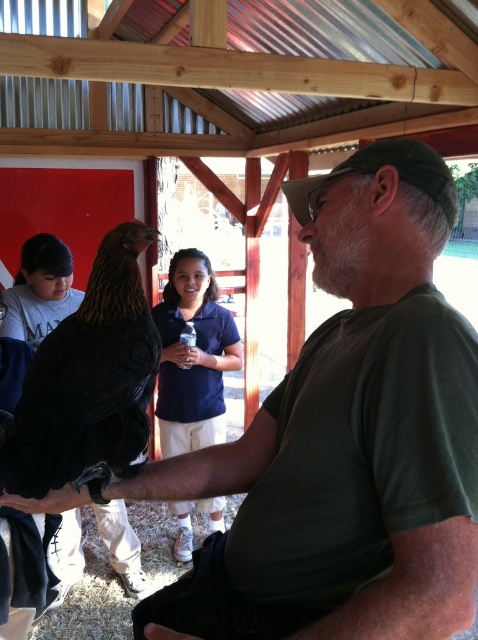
You are a photographer standing at the back of the wooden structure. You want to take a photo of the black feathered chicken at center and the dark blue shirt at center so that both are clearly visible in the frame. Given that your camera has a minimum focus distance of 5 feet, will you be able to capture both subjects in focus without moving closer?

The black feathered chicken at center and dark blue shirt at center are 6.44 feet apart from each other. Since the minimum focus distance is 5 feet, and the distance between them is greater than that, the camera can focus on both subjects without needing to move closer.

You are a farmer observing the scene. You need to determine which object takes up more space in the image between the black feathered chicken at center and the dark blue shirt at center. Which one is larger in size?

The black feathered chicken at center occupies less space than dark blue shirt at center, so the dark blue shirt at center is larger in size.

You are a photographer standing in front of the wooden structure. You notice the black feathered chicken at center and the dark blue shirt at center. Which object is positioned higher from the ground?

The black feathered chicken at center is above the dark blue shirt at center, so it is positioned higher from the ground.